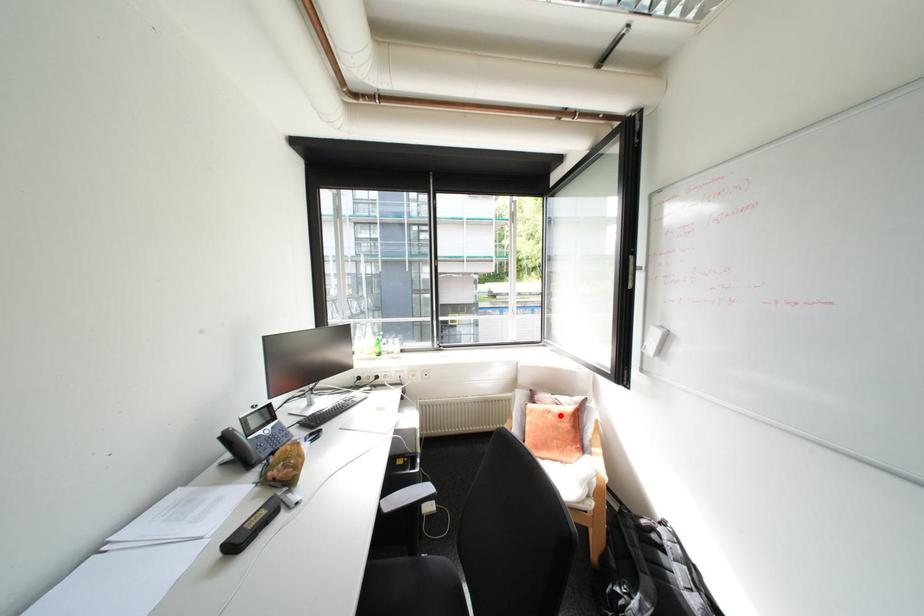
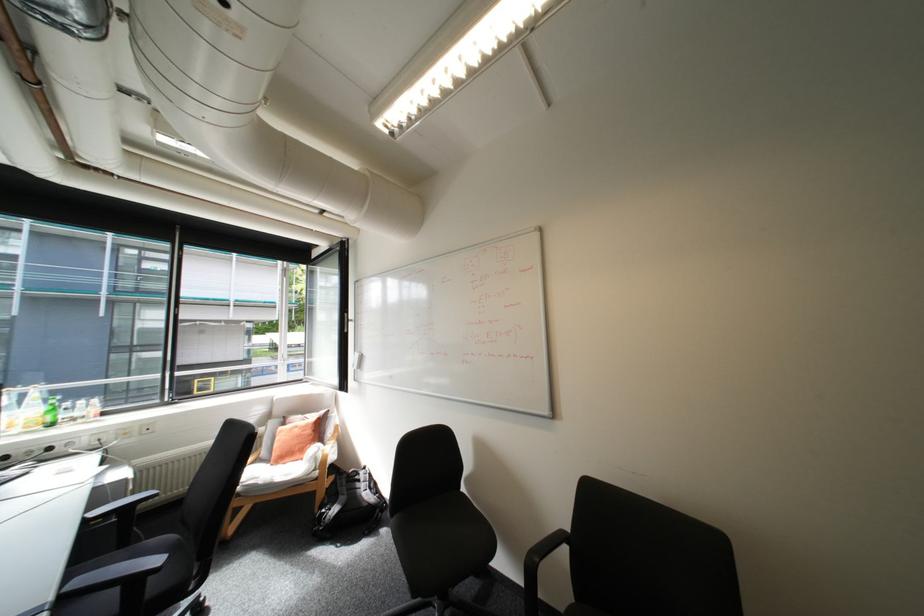
In the second image, find the point that corresponds to the highlighted location in the first image.

(307, 429)